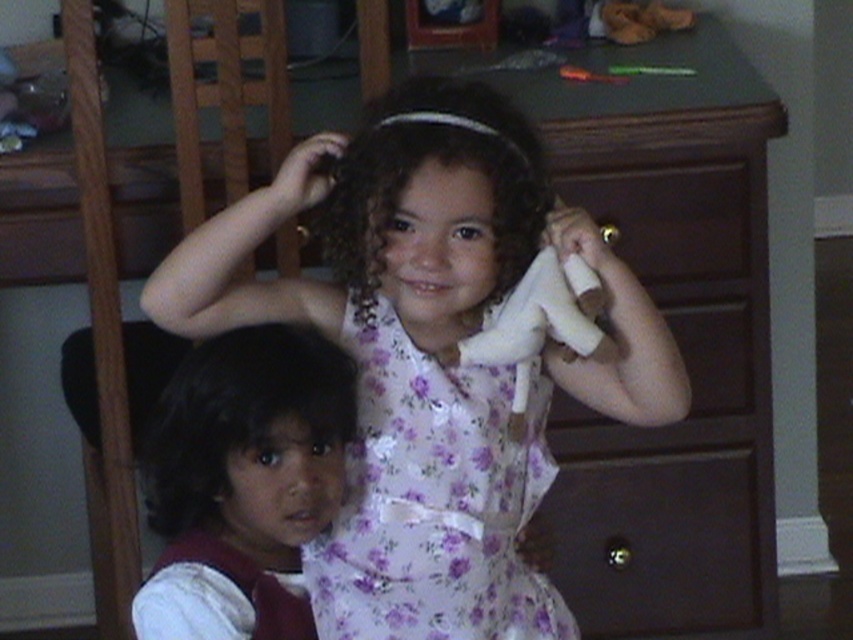
Question: Among these objects, which one is farthest from the camera?

Choices:
 (A) white floral dress at center
 (B) white cotton shirt at lower left

Answer: (B)

Question: Is curly brown hair at center thinner than white matte toy at upper center?

Choices:
 (A) yes
 (B) no

Answer: (B)

Question: Can you confirm if white floral dress at center is positioned above curly brown hair at center?

Choices:
 (A) yes
 (B) no

Answer: (B)

Question: Which point appears farthest from the camera in this image?

Choices:
 (A) (675, 468)
 (B) (695, 577)
 (C) (486, 348)
 (D) (473, 426)

Answer: (B)

Question: Considering the relative positions of white floral dress at center and metallic brown drawer at lower center in the image provided, where is white floral dress at center located with respect to metallic brown drawer at lower center?

Choices:
 (A) below
 (B) above

Answer: (B)

Question: Which point is farther from the camera taking this photo?

Choices:
 (A) (537, 608)
 (B) (625, 561)
 (C) (631, 54)
 (D) (160, 624)

Answer: (C)